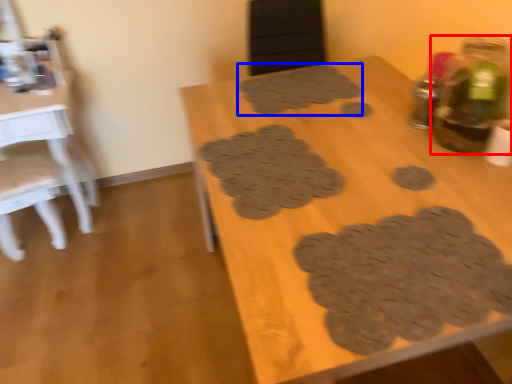
Question: Which of the following is the farthest to the observer, bottle (highlighted by a red box) or footprint (highlighted by a blue box)?

Choices:
 (A) bottle
 (B) footprint

Answer: (B)